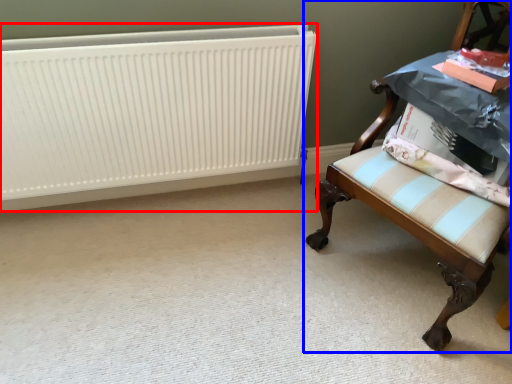
Question: Which object is further to the camera taking this photo, radiator (highlighted by a red box) or chair (highlighted by a blue box)?

Choices:
 (A) radiator
 (B) chair

Answer: (A)